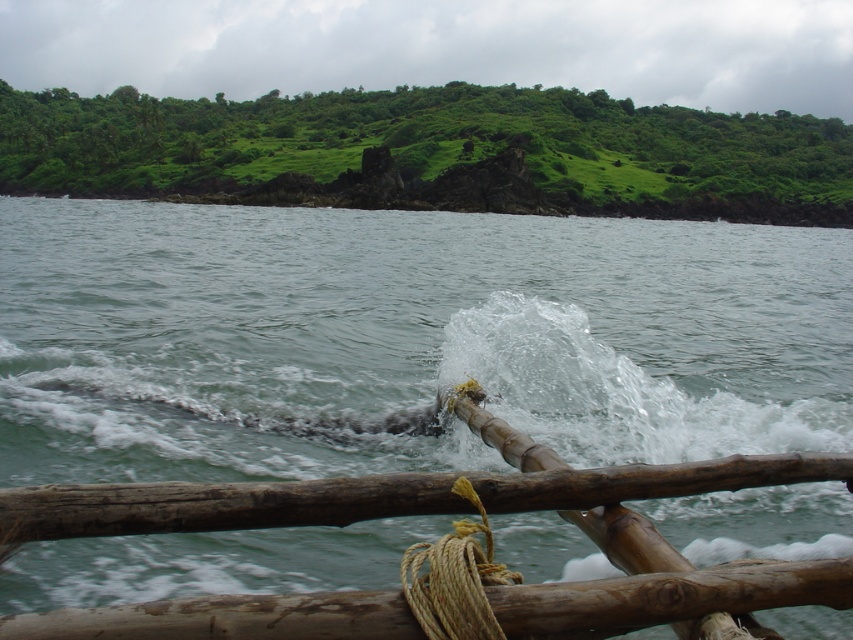
Does point (82, 417) come in front of point (482, 508)?

No, it is not.

Can you confirm if greenish water at center is shorter than natural tan rope at lower center?

No, greenish water at center is not shorter than natural tan rope at lower center.

The height and width of the screenshot is (640, 853). Identify the location of greenish water at center. (404, 339).

Find the location of a particular element. greenish water at center is located at coordinates (404, 339).